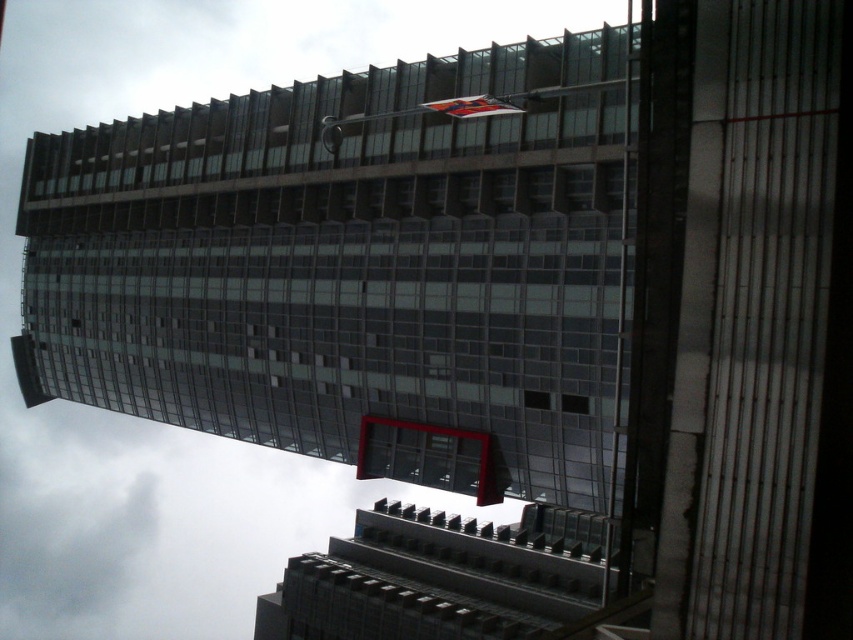
Which is more to the left, glassy steel tower at center or red fabric flag at upper center?

glassy steel tower at center

Is glassy steel tower at center shorter than red fabric flag at upper center?

No.

Find the location of `glassy steel tower at center`. glassy steel tower at center is located at coordinates (347, 264).